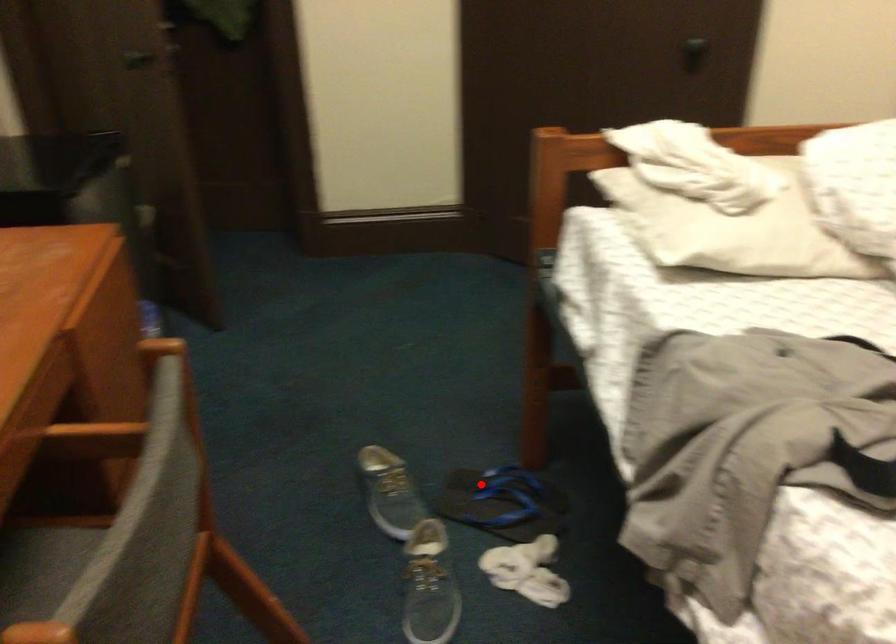
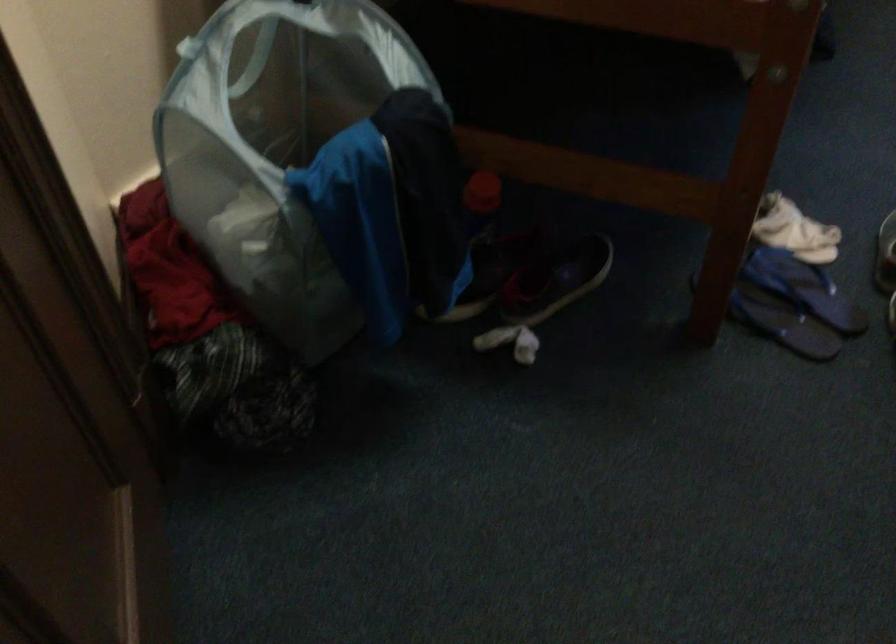
In the second image, find the point that corresponds to the highlighted location in the first image.

(782, 323)